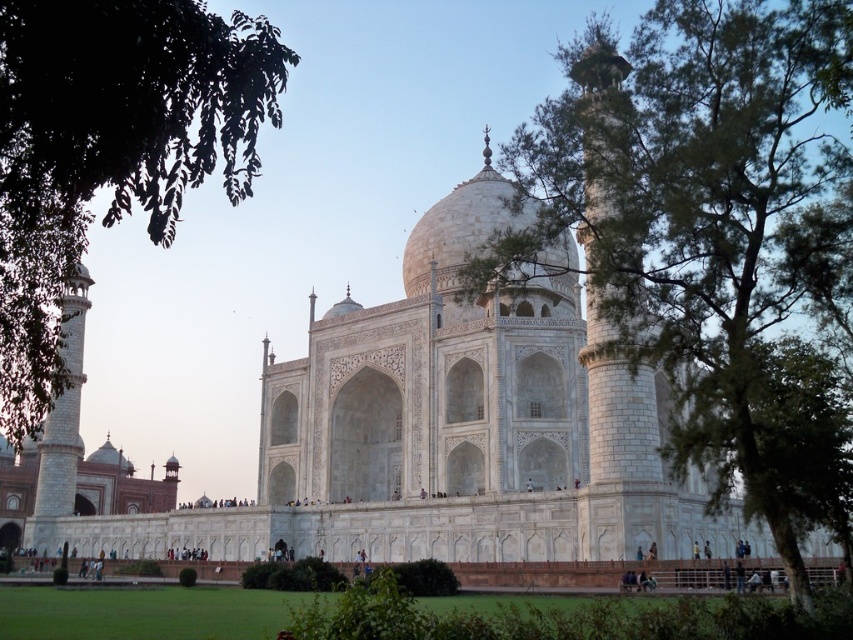
Based on the photo, you are standing in front of the Taj Mahal and want to take a photo. There are two points marked on your camera screen at coordinates point (747,288) and point (236,145). Which point is closer to you?

Point (747,288) is closer to the camera than point (236,145).